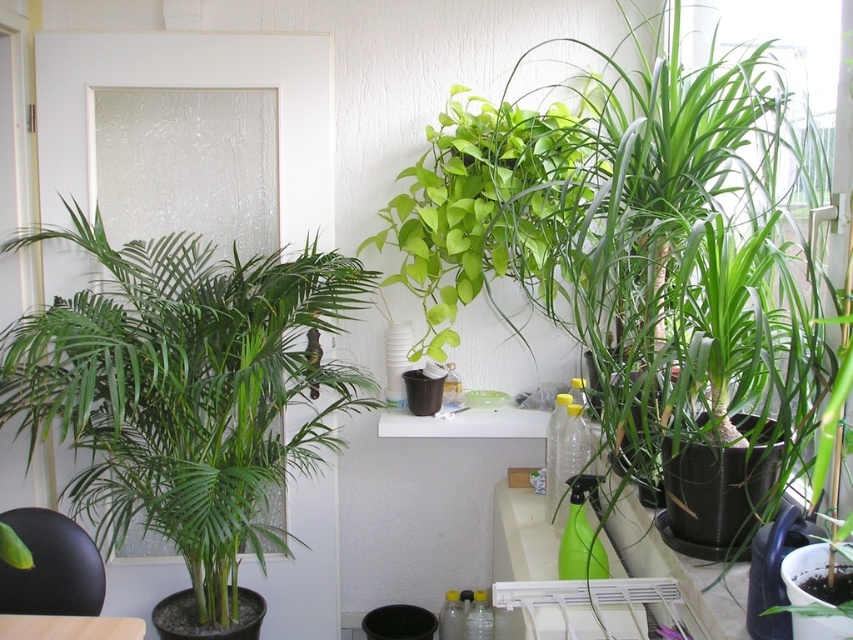
Does green leafy plant at left appear under wooden table at lower left?

No, green leafy plant at left is not below wooden table at lower left.

This screenshot has width=853, height=640. Describe the element at coordinates (184, 390) in the screenshot. I see `green leafy plant at left` at that location.

The width and height of the screenshot is (853, 640). I want to click on green leafy plant at left, so click(184, 390).

Is green glossy pothos at center behind wooden table at lower left?

Yes.

Does green glossy pothos at center have a lesser height compared to wooden table at lower left?

In fact, green glossy pothos at center may be taller than wooden table at lower left.

Which is in front, point (511, 125) or point (103, 636)?

Positioned in front is point (103, 636).

The image size is (853, 640). Identify the location of green glossy pothos at center. (486, 205).

Can you confirm if green leafy plant at left is wider than green glossy pothos at center?

Indeed, green leafy plant at left has a greater width compared to green glossy pothos at center.

Is point (189, 264) less distant than point (550, 296)?

That is False.

Identify the location of green leafy plant at left. (184, 390).